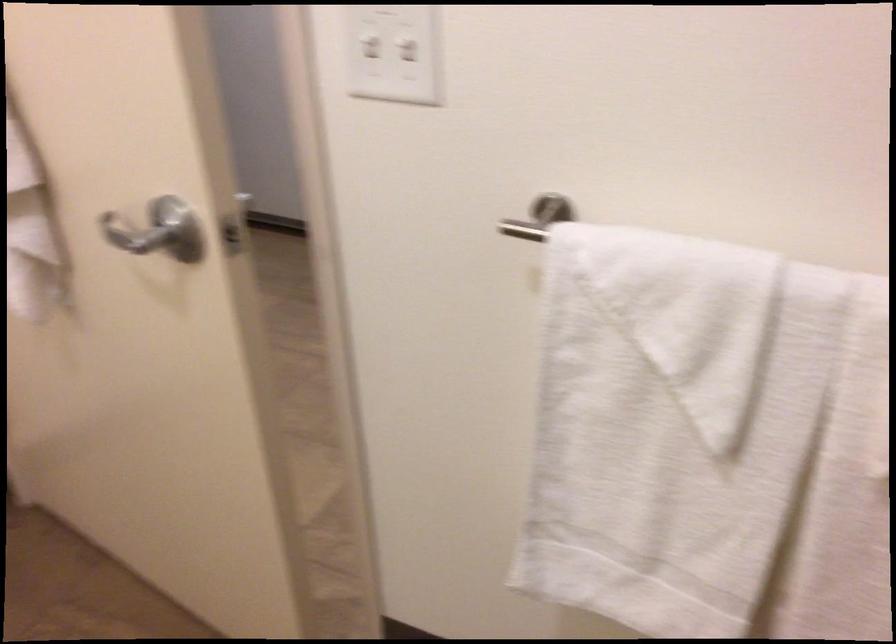
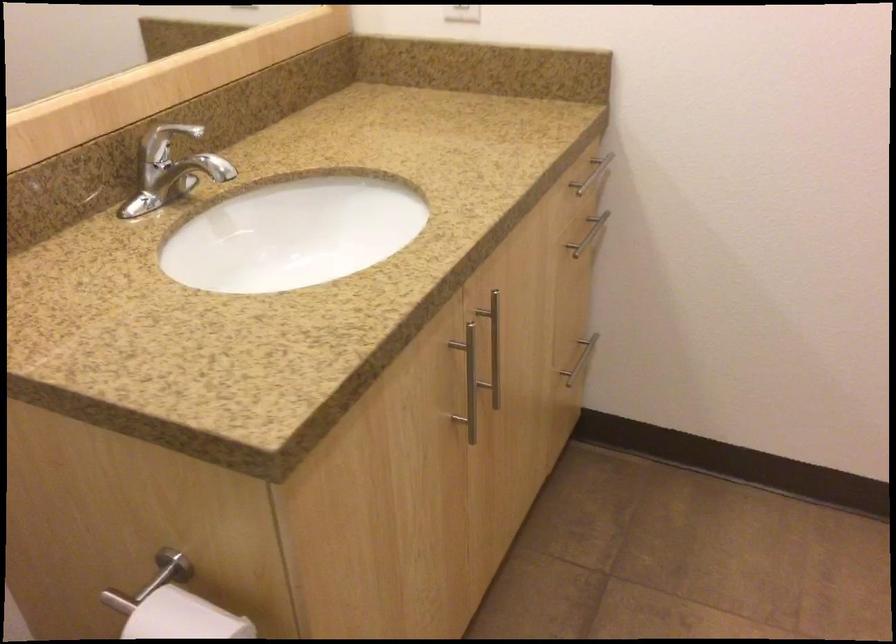
First-person continuous shooting, in which direction is the camera rotating?

The camera's rotation is toward left-down.